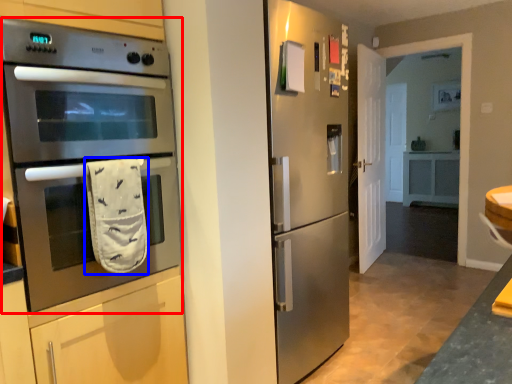
Question: Which object appears closest to the camera in this image, microwave oven (highlighted by a red box) or hand towel (highlighted by a blue box)?

Choices:
 (A) microwave oven
 (B) hand towel

Answer: (A)